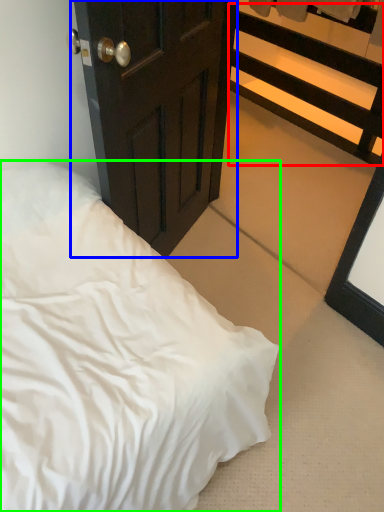
Question: Which object is positioned farthest from balustrade (highlighted by a red box)? Select from door (highlighted by a blue box) and bed (highlighted by a green box).

Choices:
 (A) door
 (B) bed

Answer: (B)